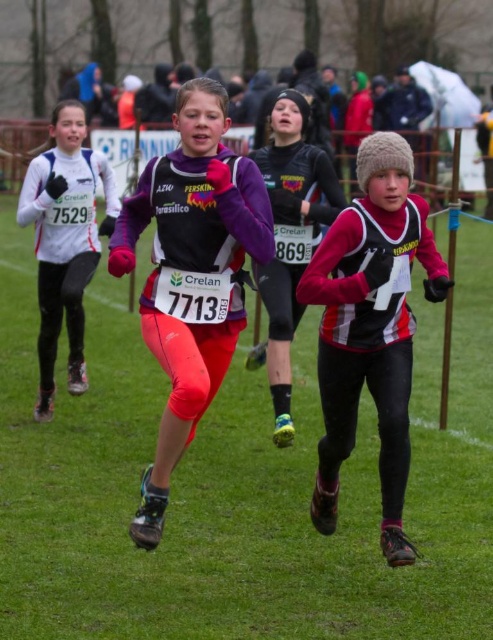
Question: Which point is farther to the camera?

Choices:
 (A) white matte running suit at left
 (B) matte red and black running suit at center
 (C) matte purple jacket at center

Answer: (A)

Question: Does purple matte running suit at center appear on the right side of matte purple jacket at center?

Choices:
 (A) no
 (B) yes

Answer: (A)

Question: Among these objects, which one is farthest from the camera?

Choices:
 (A) matte red and black running suit at center
 (B) matte purple jacket at center
 (C) white matte running suit at left

Answer: (C)

Question: Which point appears farthest from the camera in this image?

Choices:
 (A) (185, 413)
 (B) (70, 164)
 (C) (359, 314)

Answer: (B)

Question: Is matte red and black running suit at center wider than matte purple jacket at center?

Choices:
 (A) no
 (B) yes

Answer: (B)

Question: Does white matte running suit at left have a larger size compared to matte purple jacket at center?

Choices:
 (A) yes
 (B) no

Answer: (A)